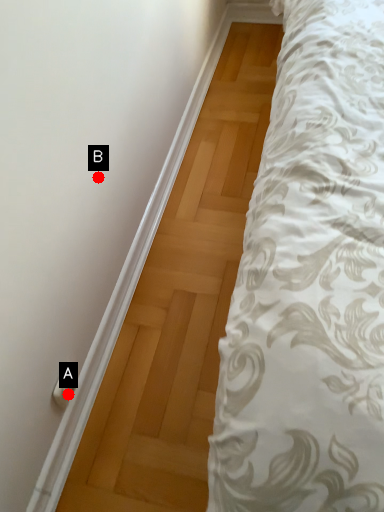
Question: Two points are circled on the image, labeled by A and B beside each circle. Among these points, which one is farthest from the camera?

Choices:
 (A) A is further
 (B) B is further

Answer: (A)